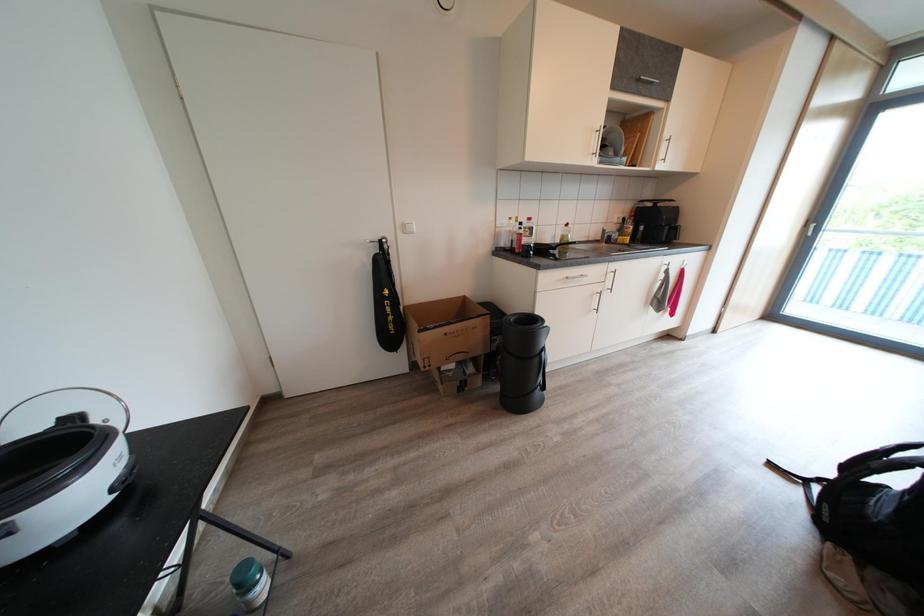
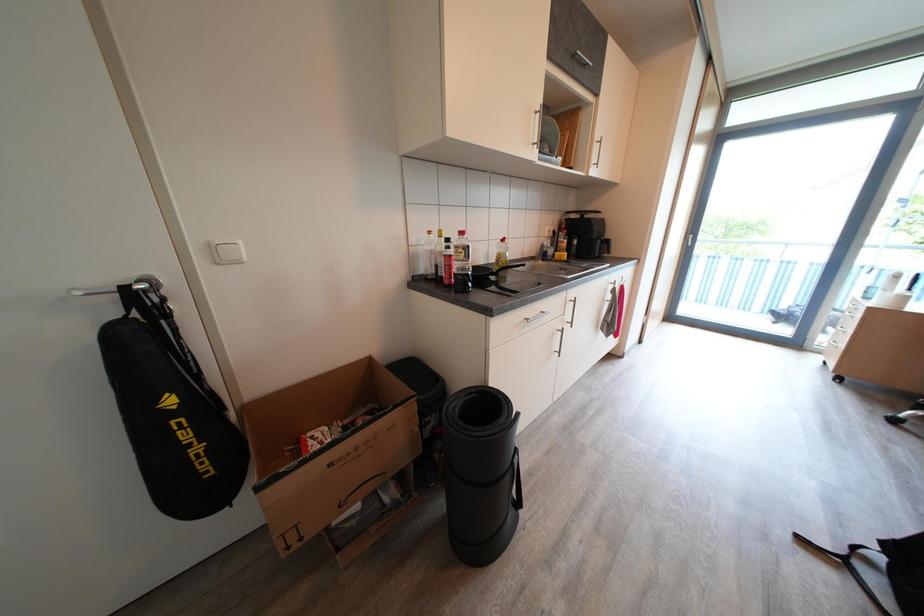
Question: How did the camera likely rotate?

Choices:
 (A) Left
 (B) Right
 (C) Up
 (D) Down

Answer: (B)